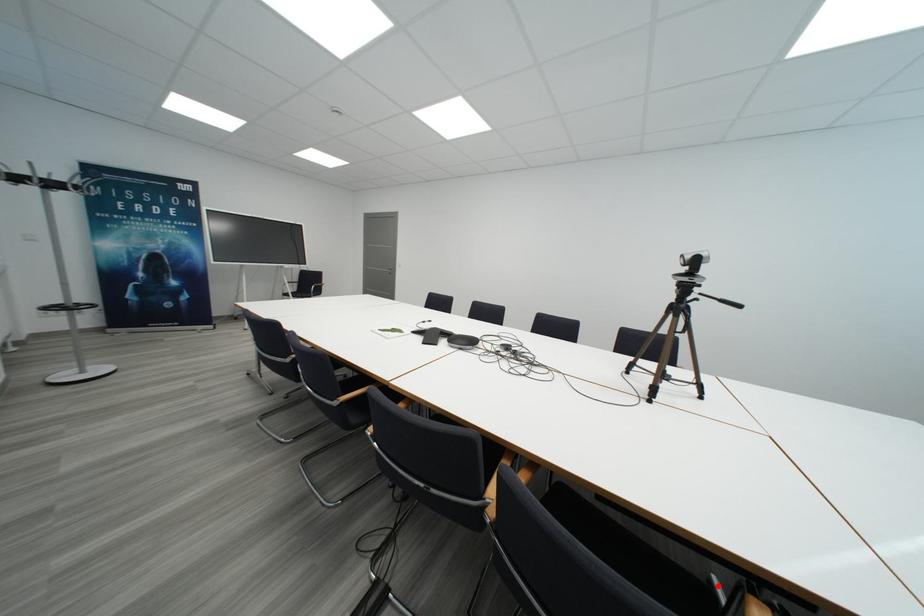
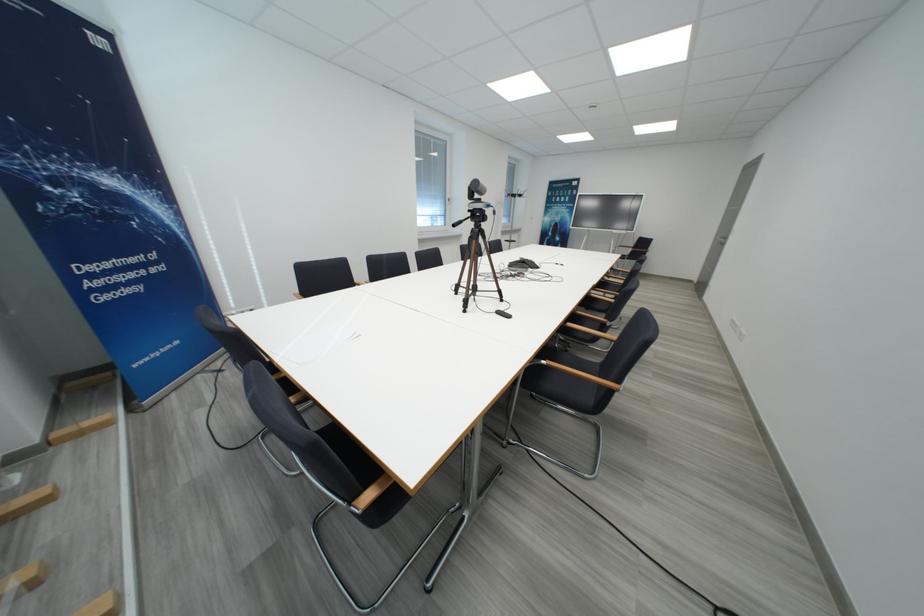
Question: I am providing you with two images of the same scene from different viewpoints. A red point is marked on the first image. Is the red point's position out of view in image 2?

Choices:
 (A) Yes
 (B) No

Answer: (A)